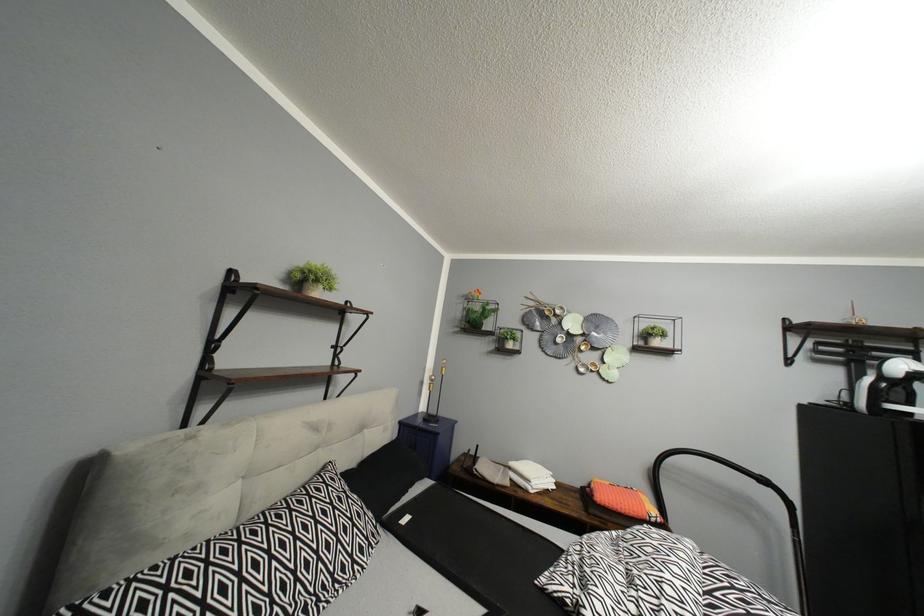
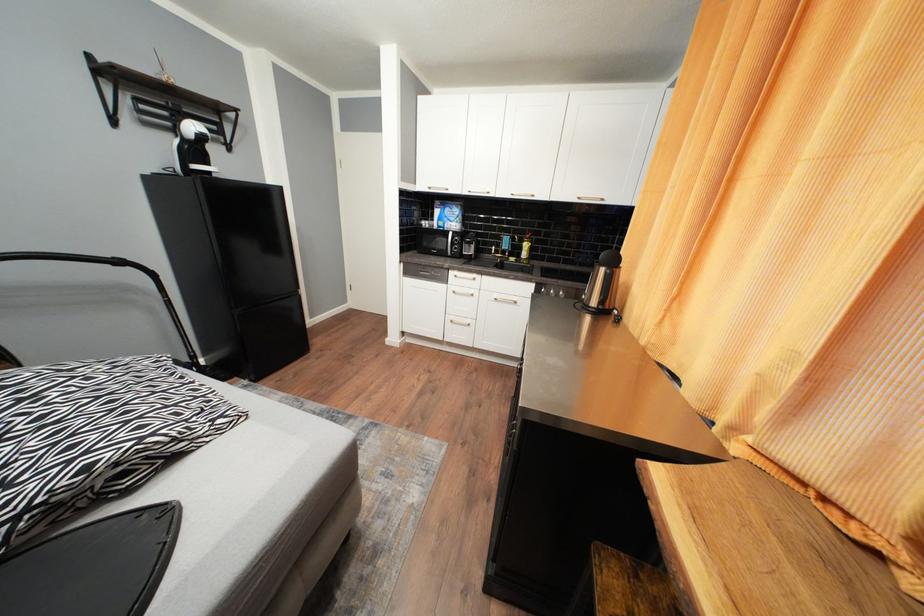
The first image is from the beginning of the video and the second image is from the end. How did the camera likely rotate when shooting the video?

The camera rotated toward right-down.